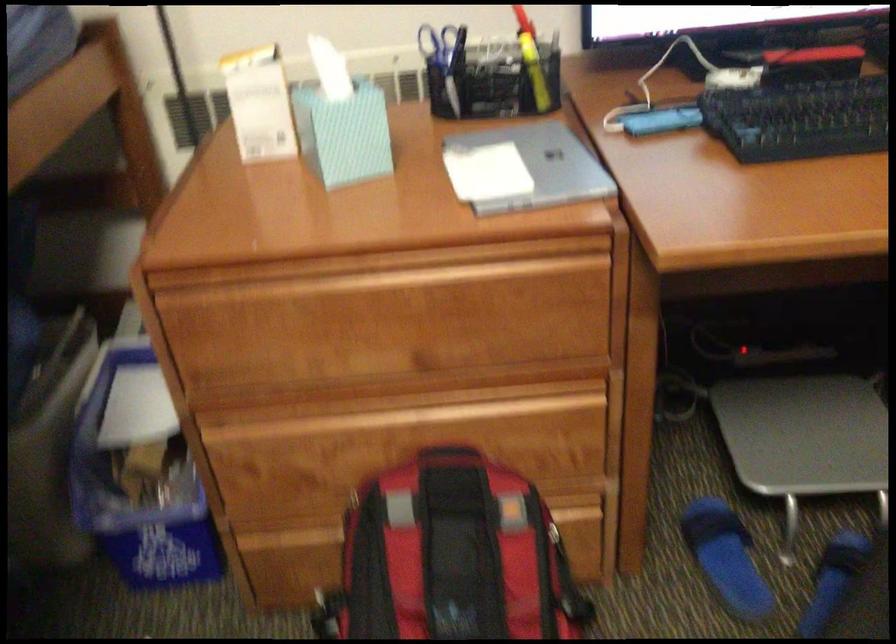
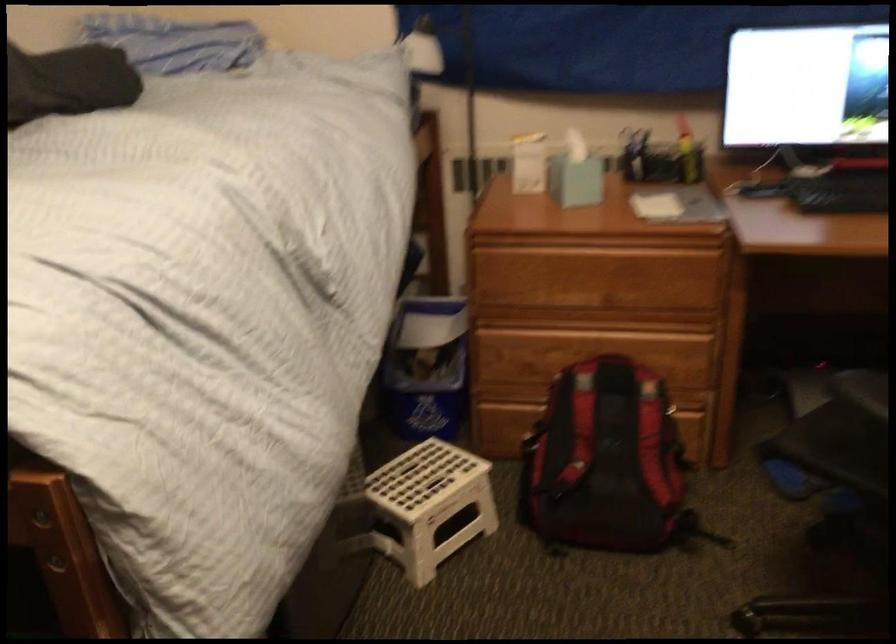
Locate, in the second image, the point that corresponds to the point at 487,77 in the first image.

(660, 158)